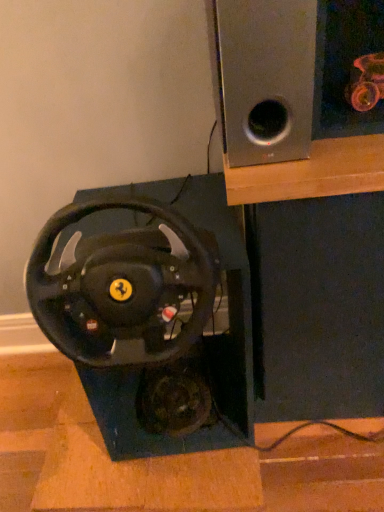
Locate an element on the screen. The width and height of the screenshot is (384, 512). silver metallic speaker at upper right is located at coordinates (265, 78).

The height and width of the screenshot is (512, 384). Describe the element at coordinates (265, 78) in the screenshot. I see `silver metallic speaker at upper right` at that location.

The width and height of the screenshot is (384, 512). In order to click on silver metallic speaker at upper right in this screenshot , I will do `click(265, 78)`.